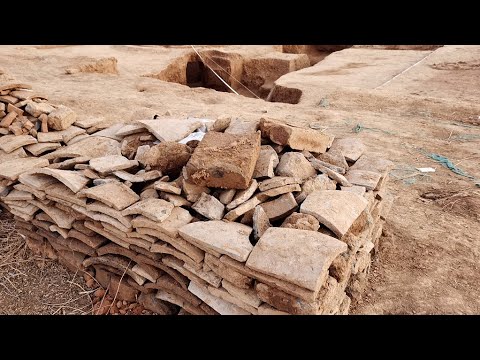
This screenshot has height=360, width=480. I want to click on wall, so click(207, 249).